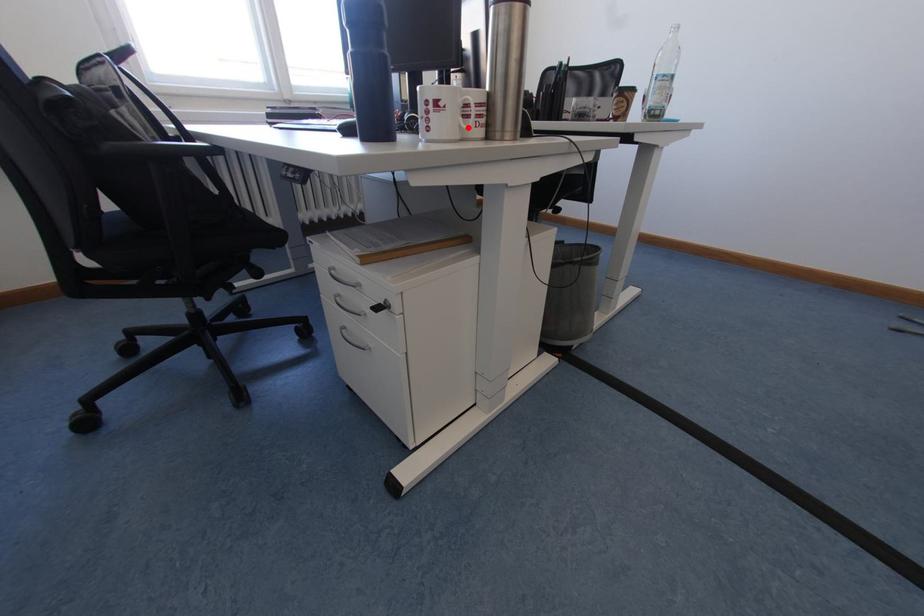
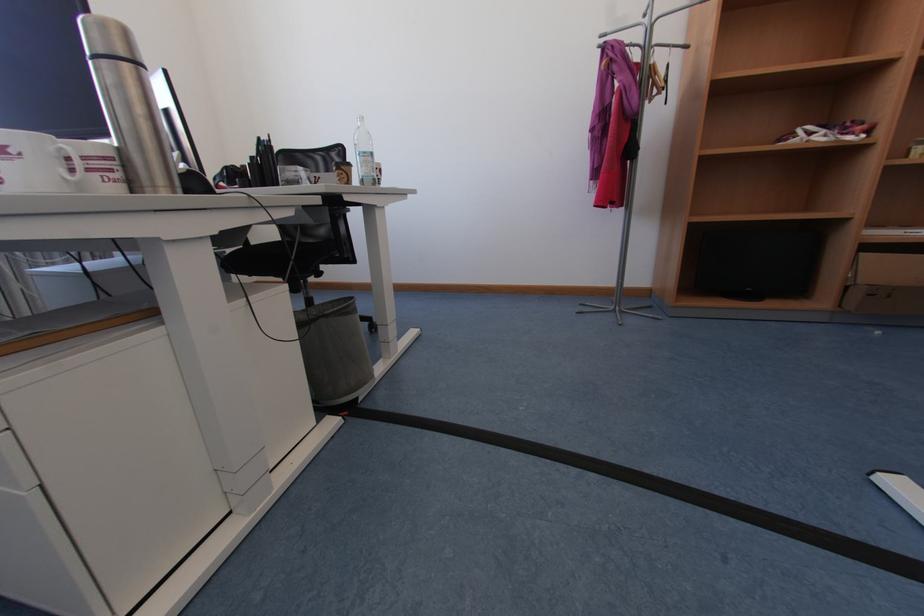
In the second image, find the point that corresponds to the highlighted location in the first image.

(71, 180)